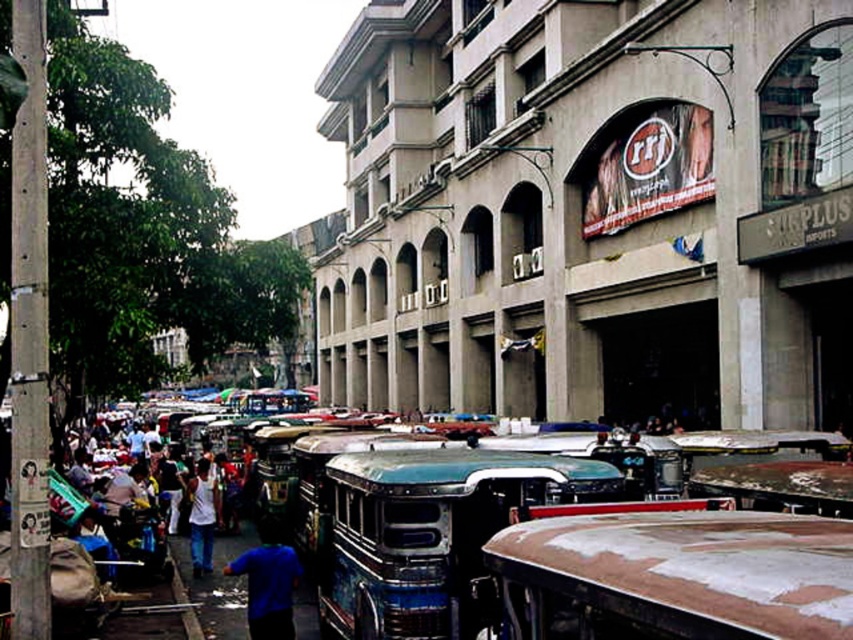
Who is more forward, (258, 608) or (207, 520)?

Positioned in front is point (258, 608).

In the scene shown: Is blue matte shirt at lower center taller than white matte shirt at center?

Correct, blue matte shirt at lower center is much taller as white matte shirt at center.

Is point (257, 628) closer to camera compared to point (190, 490)?

Yes, point (257, 628) is closer to viewer.

At what (x,y) coordinates should I click in order to perform the action: click on blue matte shirt at lower center. Please return your answer as a coordinate pair (x, y). Looking at the image, I should click on (268, 582).

Is rusty metal bus at center below blue matte shirt at lower center?

No, rusty metal bus at center is not below blue matte shirt at lower center.

Describe the element at coordinates (428, 532) in the screenshot. This screenshot has width=853, height=640. I see `rusty metal bus at center` at that location.

Where is `rusty metal bus at center`? rusty metal bus at center is located at coordinates (428, 532).

Between rusty metal bus at center and white matte shirt at center, which one is positioned higher?

rusty metal bus at center

Can you confirm if rusty metal bus at center is smaller than white matte shirt at center?

Incorrect, rusty metal bus at center is not smaller in size than white matte shirt at center.

Between point (496, 490) and point (209, 509), which one is positioned behind?

The point (209, 509) is behind.

Identify the location of rusty metal bus at center. (428, 532).